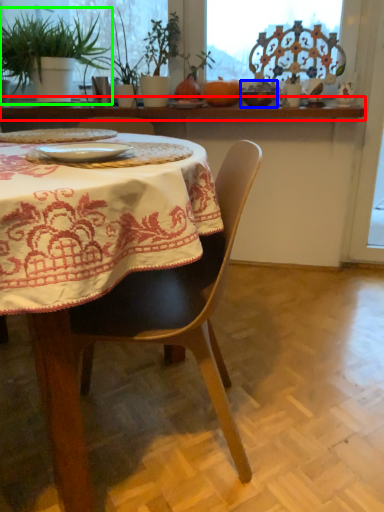
Question: Based on their relative distances, which object is nearer to window sill (highlighted by a red box)? Choose from tableware (highlighted by a blue box) and houseplant (highlighted by a green box).

Choices:
 (A) tableware
 (B) houseplant

Answer: (B)